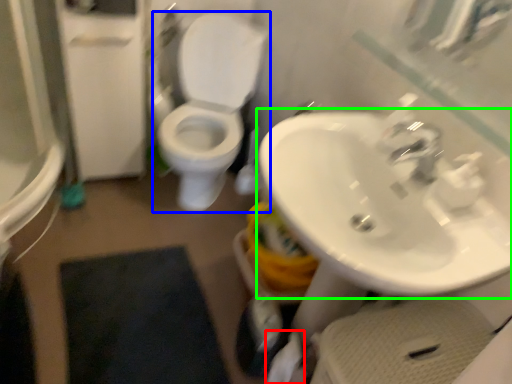
Question: Which object is the closest to the toilet paper (highlighted by a red box)? Choose among these: toilet (highlighted by a blue box) or sink (highlighted by a green box).

Choices:
 (A) toilet
 (B) sink

Answer: (B)